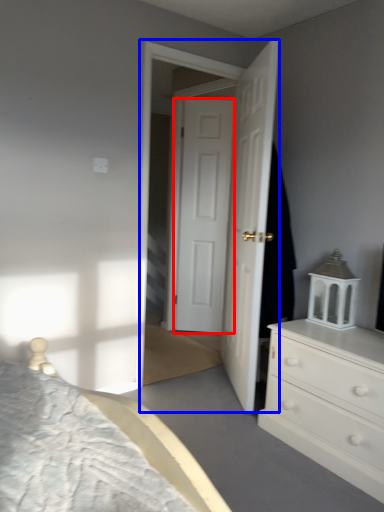
Question: Among these objects, which one is nearest to the camera, door (highlighted by a red box) or screen door (highlighted by a blue box)?

Choices:
 (A) door
 (B) screen door

Answer: (B)